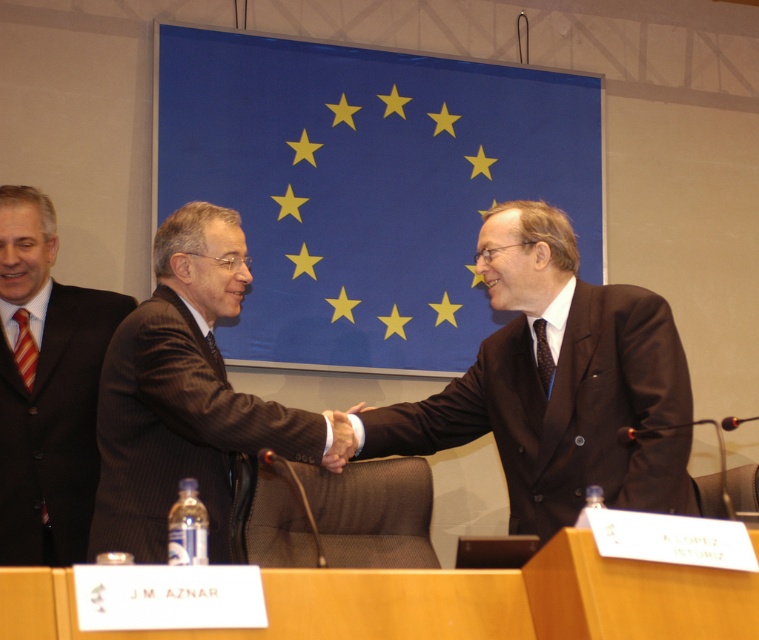
You are an event photographer positioned at the back of the room. You need to capture a photo that includes both the dark brown suit at center and the matte black suit at left. Based on their positions, which one is higher in the frame?

The dark brown suit at center is located above the matte black suit at left, so it will appear higher in the frame.

You are attending a formal meeting and need to locate two specific attendees based on their attire. The attendees are wearing a brown pinstripe suit at center and a matte black suit at left. According to the scene, which one is positioned to the right of the other?

The brown pinstripe suit at center is positioned to the right of the matte black suit at left, as described in the scene details.

You are an event photographer positioned at the back of the room. You need to capture a clear photo of the dark brown suit at center and the brown pinstripe suit at center. Which one is closer to you?

The dark brown suit at center is closer to you because it is in front of the brown pinstripe suit at center.